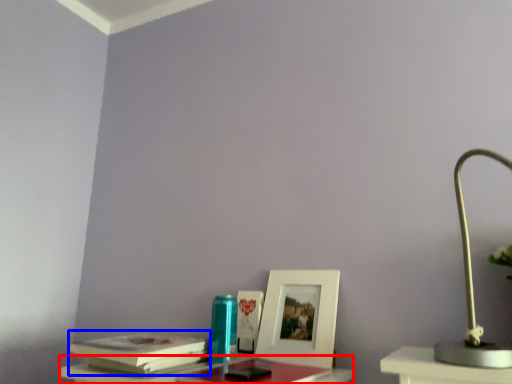
Question: Among these objects, which one is nearest to the camera, table (highlighted by a red box) or paperback book (highlighted by a blue box)?

Choices:
 (A) table
 (B) paperback book

Answer: (A)